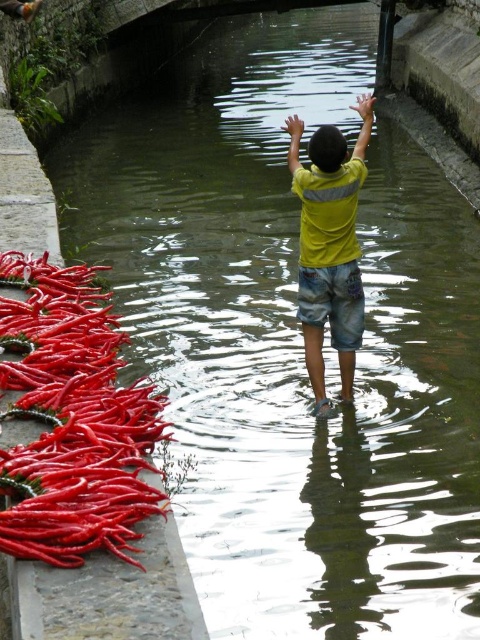
You are a photographer trying to capture the bright red chili peppers at left in the canal scene. The camera is positioned at point 0.5, 0.5. What direction should you move the camera to frame the peppers better?

The bright red chili peppers at left are located at point (72, 420). Since the camera is at (240, 320), you should move the camera upward and to the right to frame them better.

You are navigating a small boat along the canal and want to reach the point marked by point (29, 356). You are currently at point (301, 218). Based on the scene description, which direction should you steer your boat to move closer to your destination?

You should steer your boat forward because point (29, 356) is in front of point (301, 218).